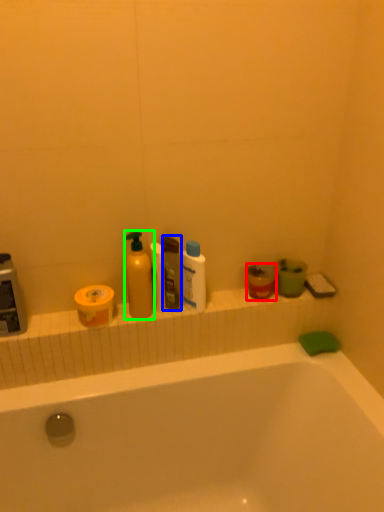
Question: Which is nearer to the mouthwash (highlighted by a red box)? toiletry (highlighted by a blue box) or cleaning product (highlighted by a green box).

Choices:
 (A) toiletry
 (B) cleaning product

Answer: (A)